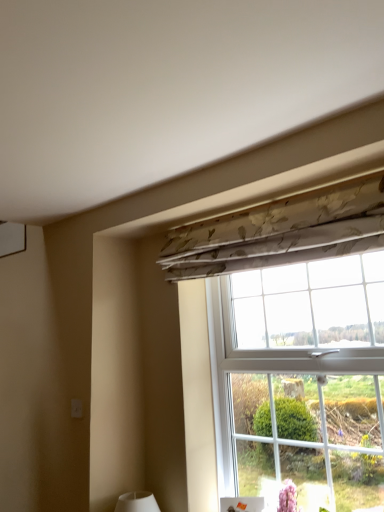
This screenshot has height=512, width=384. What are the coordinates of `floral fabric at upper center` in the screenshot? It's located at (295, 340).

Describe the element at coordinates (295, 340) in the screenshot. I see `floral fabric at upper center` at that location.

Measure the distance between point (275, 258) and camera.

Point (275, 258) is 5.65 feet from camera.

This screenshot has height=512, width=384. What do you see at coordinates (280, 232) in the screenshot?
I see `floral fabric curtain at upper center` at bounding box center [280, 232].

You are a GUI agent. You are given a task and a screenshot of the screen. Output one action in this format:
    pyautogui.click(x=<x>, y=<y>)
    Task: Click on the floral fabric curtain at upper center
    This screenshot has height=512, width=384.
    Given the screenshot: What is the action you would take?
    pyautogui.click(x=280, y=232)

The width and height of the screenshot is (384, 512). I want to click on floral fabric at upper center, so click(295, 340).

Does floral fabric at upper center appear on the left side of floral fabric curtain at upper center?

In fact, floral fabric at upper center is to the right of floral fabric curtain at upper center.

Does floral fabric at upper center come behind floral fabric curtain at upper center?

No, floral fabric at upper center is closer to the camera.

Does point (354, 195) appear closer or farther from the camera than point (190, 257)?

Point (354, 195) appears to be closer to the viewer than point (190, 257).

From the image's perspective, between floral fabric at upper center and floral fabric curtain at upper center, who is located below?

From the image's view, floral fabric at upper center is below.

From a real-world perspective, between floral fabric at upper center and floral fabric curtain at upper center, who is vertically lower?

floral fabric at upper center is physically lower.

Considering the sizes of objects floral fabric at upper center and floral fabric curtain at upper center in the image provided, who is wider, floral fabric at upper center or floral fabric curtain at upper center?

floral fabric at upper center.

Does floral fabric at upper center have a lesser height compared to floral fabric curtain at upper center?

In fact, floral fabric at upper center may be taller than floral fabric curtain at upper center.

Considering the sizes of objects floral fabric at upper center and floral fabric curtain at upper center in the image provided, who is smaller, floral fabric at upper center or floral fabric curtain at upper center?

floral fabric curtain at upper center is smaller.

Choose the correct answer: Is floral fabric at upper center inside floral fabric curtain at upper center or outside it?

floral fabric at upper center is spatially situated outside floral fabric curtain at upper center.

Is floral fabric at upper center next to floral fabric curtain at upper center?

No.

Could you tell me if floral fabric at upper center is turned towards floral fabric curtain at upper center?

Yes, floral fabric at upper center is facing floral fabric curtain at upper center.

How much distance is there between floral fabric at upper center and floral fabric curtain at upper center?

floral fabric at upper center is 12.38 inches away from floral fabric curtain at upper center.

You are a GUI agent. You are given a task and a screenshot of the screen. Output one action in this format:
    pyautogui.click(x=<x>, y=<y>)
    Task: Click on the window in front of the floral fabric curtain at upper center
    Image resolution: width=384 pixels, height=512 pixels.
    Given the screenshot: What is the action you would take?
    coord(295,340)

Looking at this image, between floral fabric curtain at upper center and floral fabric at upper center, which one appears on the right side from the viewer's perspective?

Positioned to the right is floral fabric at upper center.

Considering the relative positions of floral fabric curtain at upper center and floral fabric at upper center in the image provided, is floral fabric curtain at upper center behind floral fabric at upper center?

Yes, floral fabric curtain at upper center is further from the camera.

In the scene shown: Which point is more distant from viewer, (x=231, y=256) or (x=254, y=214)?

Point (x=231, y=256)

From the image's perspective, is floral fabric curtain at upper center above or below floral fabric at upper center?

Clearly, from the image's perspective, floral fabric curtain at upper center is above floral fabric at upper center.

From a real-world perspective, is floral fabric curtain at upper center positioned under floral fabric at upper center based on gravity?

Actually, floral fabric curtain at upper center is physically above floral fabric at upper center in the real world.

Can you confirm if floral fabric curtain at upper center is wider than floral fabric at upper center?

Incorrect, the width of floral fabric curtain at upper center does not surpass that of floral fabric at upper center.

Can you confirm if floral fabric curtain at upper center is taller than floral fabric at upper center?

No, floral fabric curtain at upper center is not taller than floral fabric at upper center.

Between floral fabric curtain at upper center and floral fabric at upper center, which one has smaller size?

floral fabric curtain at upper center is smaller.

Which is correct: floral fabric curtain at upper center is inside floral fabric at upper center, or outside of it?

floral fabric curtain at upper center is outside floral fabric at upper center.

Consider the image. Is floral fabric curtain at upper center touching floral fabric at upper center?

No, floral fabric curtain at upper center is not with floral fabric at upper center.

Looking at this image, is floral fabric at upper center at the back of floral fabric curtain at upper center?

Absolutely, floral fabric curtain at upper center is directed away from floral fabric at upper center.

How different are the orientations of floral fabric curtain at upper center and floral fabric at upper center in degrees?

0.73 degrees.

The height and width of the screenshot is (512, 384). I want to click on curtain that is above the floral fabric at upper center (from a real-world perspective), so click(x=280, y=232).

Where is `window below the floral fabric curtain at upper center (from the image's perspective)`? The height and width of the screenshot is (512, 384). window below the floral fabric curtain at upper center (from the image's perspective) is located at coordinates (295, 340).

Identify the location of window located on the right of floral fabric curtain at upper center. This screenshot has height=512, width=384. (295, 340).